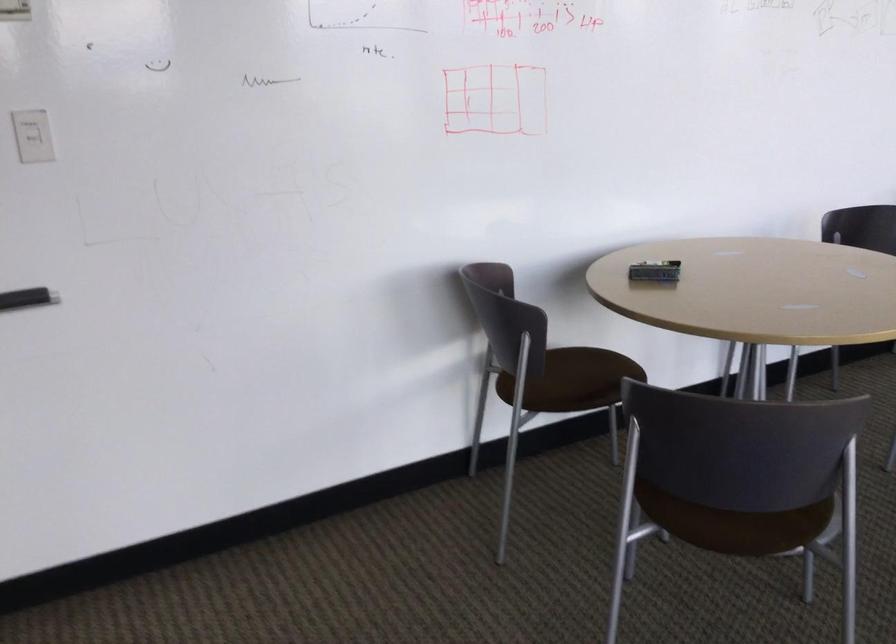
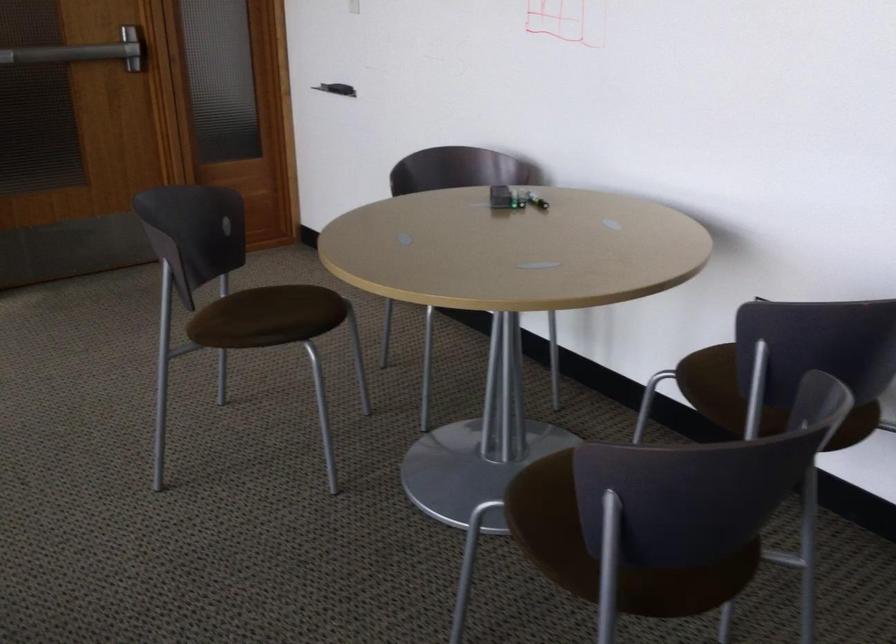
The point at (752, 478) is marked in the first image. Where is the corresponding point in the second image?

(276, 317)